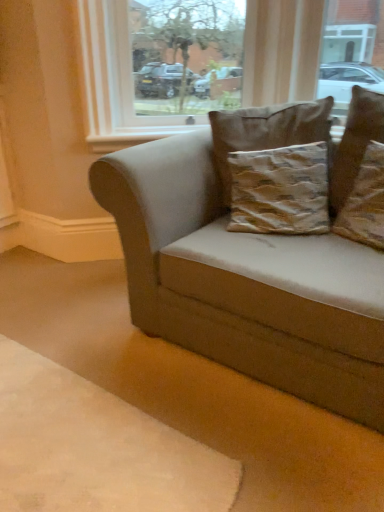
Question: Does point (342, 403) appear closer or farther from the camera than point (362, 95)?

Choices:
 (A) closer
 (B) farther

Answer: (A)

Question: In terms of width, does suede beige couch at center look wider or thinner when compared to textured brown pillow at upper right, which is the 2th pillow in right-to-left order?

Choices:
 (A) thin
 (B) wide

Answer: (B)

Question: Based on their relative distances, which object is farther from the brown textured cushion at center, which is the first pillow from left to right?

Choices:
 (A) textured brown pillow at upper right, which is the 2th pillow in right-to-left order
 (B) transparent glass window at upper center
 (C) beige fabric dog bed at lower right
 (D) suede beige couch at center
 (E) brown textured pillow at upper right, which is the third pillow from left to right

Answer: (C)

Question: Which of these objects is positioned closest to the brown textured cushion at center, which is the first pillow from left to right?

Choices:
 (A) suede beige couch at center
 (B) transparent glass window at upper center
 (C) textured brown pillow at upper right, which ranks as the 2th pillow in left-to-right order
 (D) brown textured pillow at upper right, which ranks as the 1th pillow in right-to-left order
 (E) beige fabric dog bed at lower right

Answer: (C)